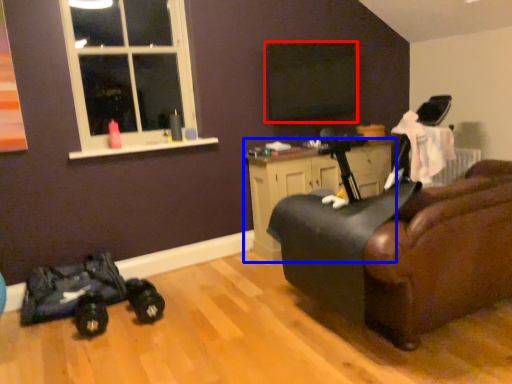
Question: Which object appears closest to the camera in this image, window screen (highlighted by a red box) or cabinetry (highlighted by a blue box)?

Choices:
 (A) window screen
 (B) cabinetry

Answer: (B)